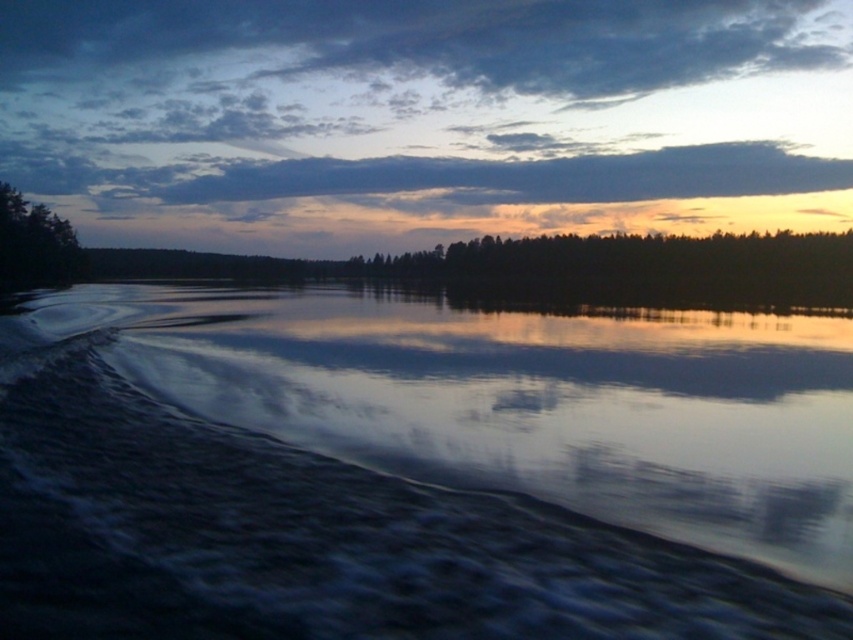
You are standing on the lakeside and looking towards the horizon. You notice two green matte trees at center and a green matte tree at left. Which tree is closer to the horizon?

The green matte trees at center is positioned under the green matte tree at left, meaning it is closer to the horizon.

You are standing at the edge of the lake and notice a point marked at coordinates (637,266). What can you see at that location?

At point (637,266) lies green matte trees at center.

You are an artist trying to paint the lakeside scene. You want to ensure the dark reflective water at lower left and the green matte trees at center are proportionally accurate. Which object should you paint first to maintain the correct size relationship between them?

You should paint the green matte trees at center first because the dark reflective water at lower left is smaller in size compared to them, allowing you to establish the larger element before adjusting the smaller one accordingly.